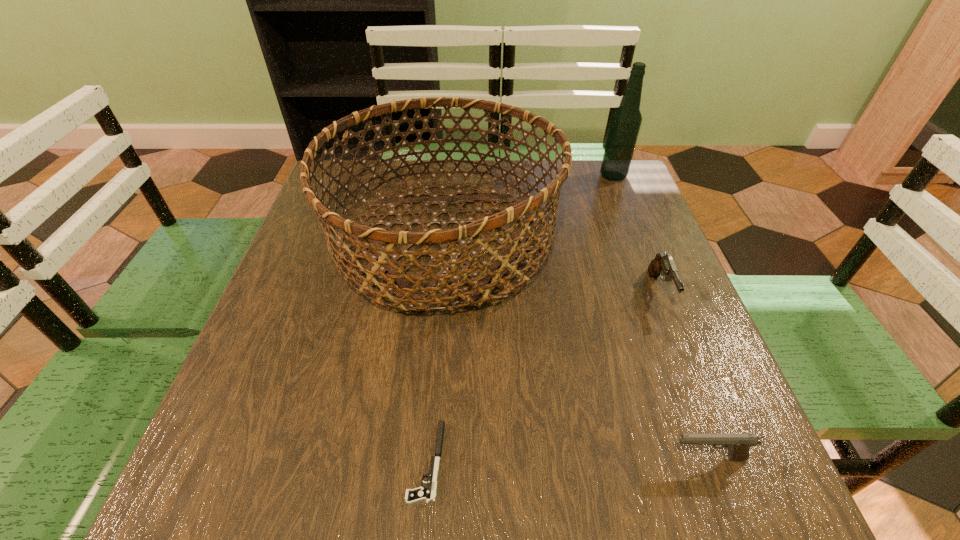
You are a GUI agent. You are given a task and a screenshot of the screen. Output one action in this format:
    pyautogui.click(x=<x>, y=<y>)
    Task: Click on the vacant space that's between the second shortest pistol and the farthest pistol
    This screenshot has height=540, width=960.
    Given the screenshot: What is the action you would take?
    pyautogui.click(x=684, y=374)

This screenshot has height=540, width=960. Identify the location of free space between the second tallest object and the shortest pistol. (435, 349).

Image resolution: width=960 pixels, height=540 pixels. Find the location of `object identified as the second closest to the fourth shortest object`. object identified as the second closest to the fourth shortest object is located at coordinates (x=663, y=264).

What are the coordinates of `object that can be found as the fourth closest to the tallest object` in the screenshot? It's located at (427, 493).

Select which pistol is the closest to the fourth shortest object. Please provide its 2D coordinates. Your answer should be formatted as a tuple, i.e. [(x, y)], where the tuple contains the x and y coordinates of a point satisfying the conditions above.

[(663, 264)]

In order to click on the closest pistol to the fourth shortest object in this screenshot , I will do `click(663, 264)`.

Identify the location of free region that satisfies the following two spatial constraints: 1. at the barrel of the farthest pistol; 2. on the front-facing side of the shortest object. Image resolution: width=960 pixels, height=540 pixels. (727, 461).

At what (x,y) coordinates should I click in order to perform the action: click on vacant region that satisfies the following two spatial constraints: 1. at the barrel of the farthest pistol; 2. at the barrel of the second tallest pistol. Please return your answer as a coordinate pair (x, y). The height and width of the screenshot is (540, 960). Looking at the image, I should click on (726, 458).

Locate an element on the screen. vacant region that satisfies the following two spatial constraints: 1. at the barrel of the farthest pistol; 2. on the front-facing side of the shortest pistol is located at coordinates (727, 461).